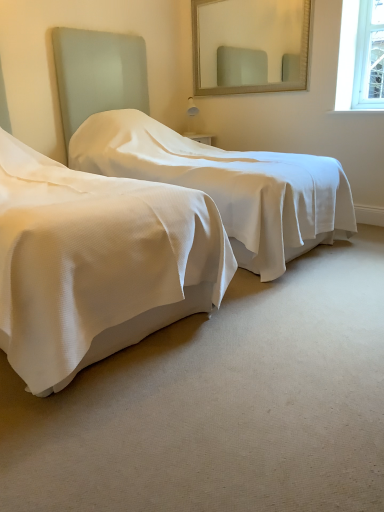
Question: From a real-world perspective, is white textured bed at left, the first bed in the right-to-left sequence, above or below white textured bed at center, which is the 2th bed from right to left?

Choices:
 (A) above
 (B) below

Answer: (A)

Question: Considering the positions of point (309, 214) and point (226, 284), is point (309, 214) closer or farther from the camera than point (226, 284)?

Choices:
 (A) closer
 (B) farther

Answer: (B)

Question: Which is farther from the white textured bed at center, which is the 2th bed from right to left?

Choices:
 (A) matte glass mirror at upper center
 (B) white textured bed at left, which is the 2th bed in left-to-right order

Answer: (A)

Question: Considering the real-world distances, which object is farthest from the matte glass mirror at upper center?

Choices:
 (A) white textured bed at center, which is the 2th bed from right to left
 (B) white textured bed at left, the first bed in the right-to-left sequence

Answer: (A)